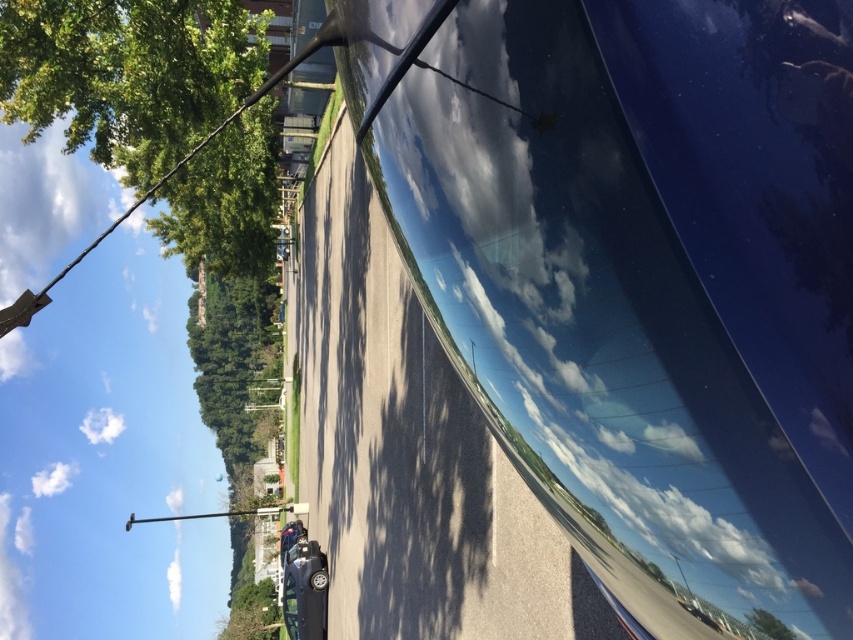
You are a driver looking through the windshield of your car. You notice two green leafy trees ahead on the street. Which tree, the green leafy tree at upper left or the green leafy tree at center, is taller?

The green leafy tree at center is taller than the green leafy tree at upper left.

You are a delivery driver who needs to park your vehicle in a spot that is exactly 15 meters away from the glossy blue car at center. Based on the scene, can you park behind the green leafy tree at upper left to meet this requirement?

The distance between the glossy blue car at center and the green leafy tree at upper left is 13.08 meters, which is less than 15 meters. Therefore, parking behind the green leafy tree at upper left would not meet the requirement of being exactly 15 meters away from the glossy blue car at center.

You are driving a car and looking out the windshield. There is a point marked at coordinates (128, 74). What object is located at that point?

The point at coordinates (128, 74) marks a green leafy tree at upper left.